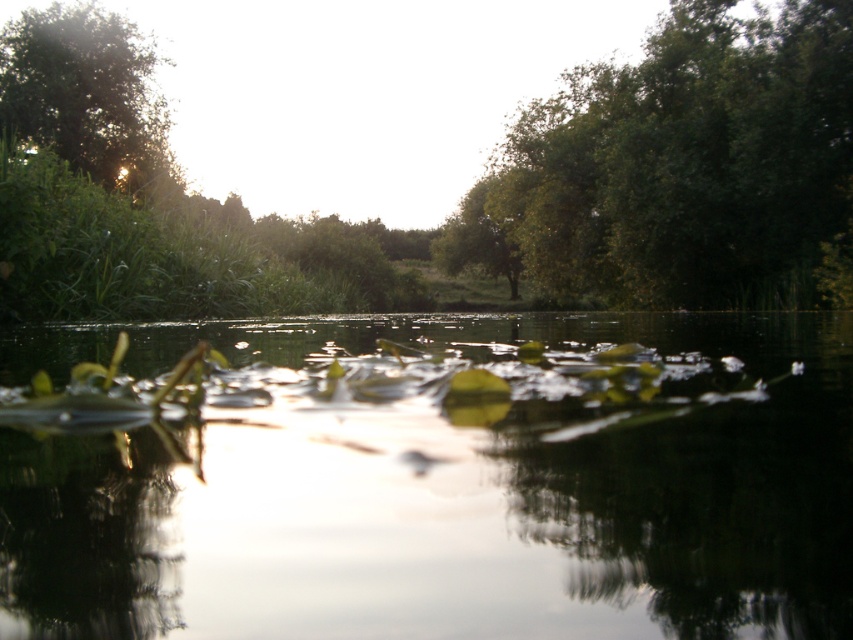
What do you see at coordinates (679, 168) in the screenshot?
I see `green leafy tree at upper center` at bounding box center [679, 168].

Does green leafy tree at upper center have a greater height compared to green grass at upper left?

Correct, green leafy tree at upper center is much taller as green grass at upper left.

At what (x,y) coordinates should I click in order to perform the action: click on green leafy tree at upper center. Please return your answer as a coordinate pair (x, y). This screenshot has width=853, height=640. Looking at the image, I should click on (679, 168).

Who is more forward, (543, 458) or (148, 74)?

Point (543, 458)

Between point (317, 609) and point (33, 49), which one is positioned behind?

Positioned behind is point (33, 49).

Find the location of a particular element. This screenshot has height=640, width=853. green leafy plants at center is located at coordinates (432, 477).

Is point (728, 300) in front of point (108, 100)?

Yes, it is.

Does point (532, 280) come behind point (137, 52)?

Yes.

Where is `green leafy tree at upper center`? This screenshot has width=853, height=640. green leafy tree at upper center is located at coordinates (679, 168).